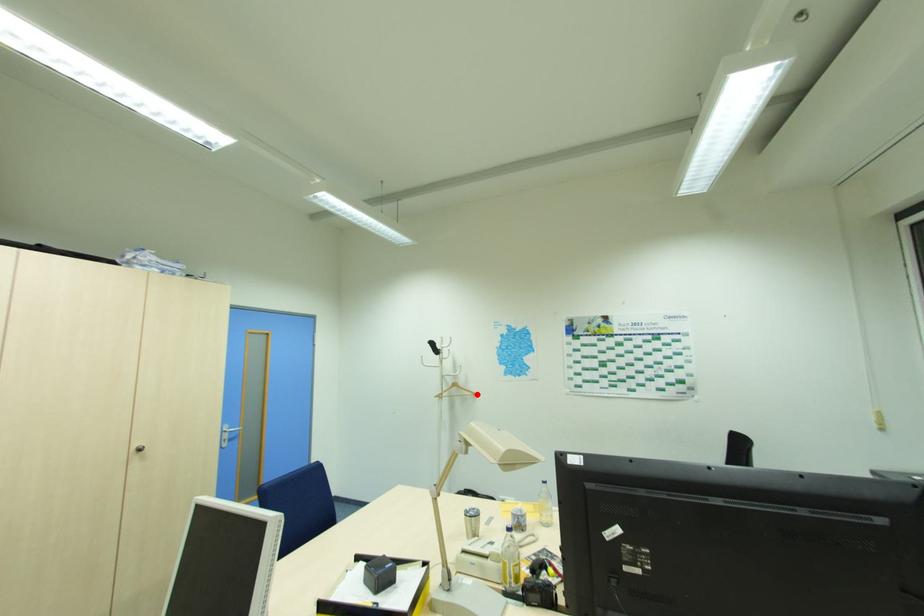
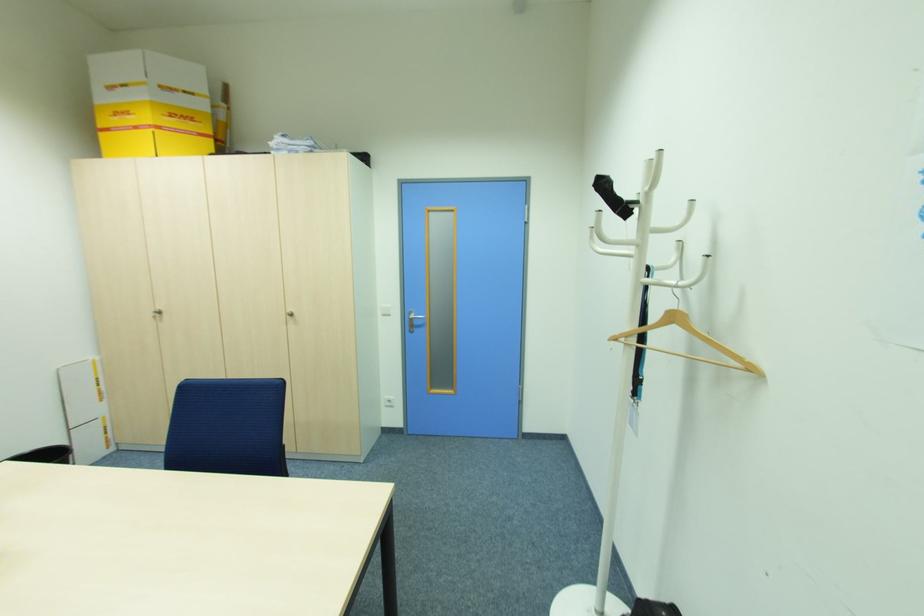
Find the pixel in the second image that matches the highlighted location in the first image.

(756, 370)